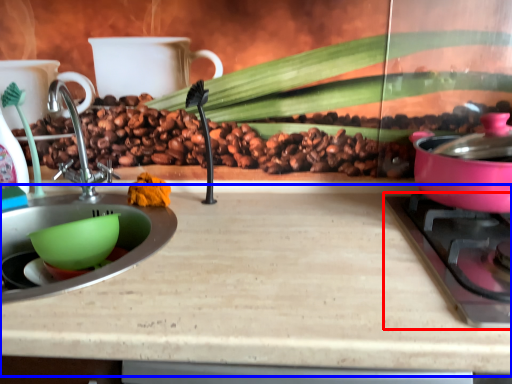
Question: Which object is further to the camera taking this photo, gas stove (highlighted by a red box) or counter top (highlighted by a blue box)?

Choices:
 (A) gas stove
 (B) counter top

Answer: (A)